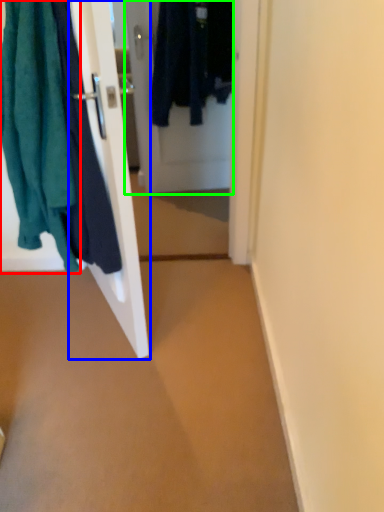
Question: Based on their relative distances, which object is nearer to towel (highlighted by a red box)? Choose from door (highlighted by a blue box) and door (highlighted by a green box).

Choices:
 (A) door
 (B) door

Answer: (A)